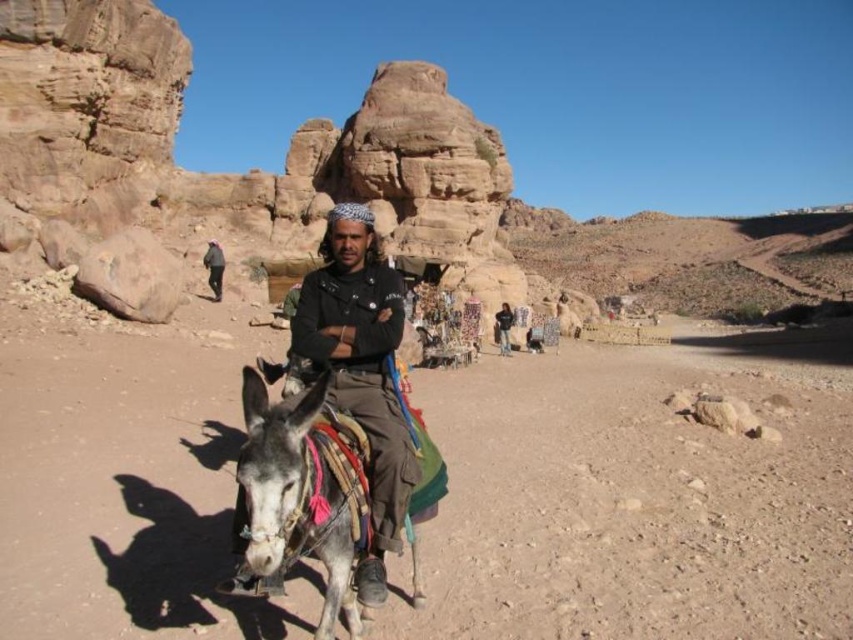
You are a traveler observing the gray textured donkey at center and the black matte shirt at center. Which object is taller?

The black matte shirt at center is taller than the gray textured donkey at center.

You are navigating a desert path and see two points marked on your map. The first point is at coordinates point [386,364] and the second point is at point [502,330]. According to the scene, which point is closer to you as you face the direction of travel?

Point [386,364] is in front of point [502,330], so the first point is closer to you as you face the direction of travel.